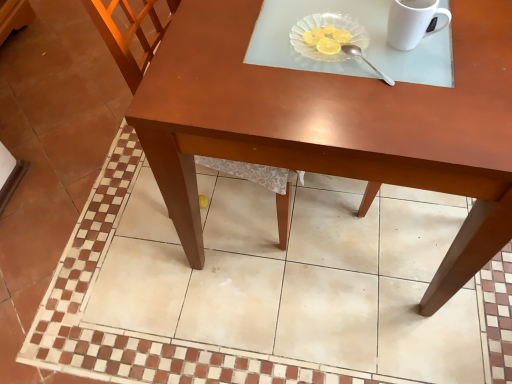
Where is `unoccupied area in front of white glossy mug at upper right`? This screenshot has height=384, width=512. unoccupied area in front of white glossy mug at upper right is located at coordinates (419, 97).